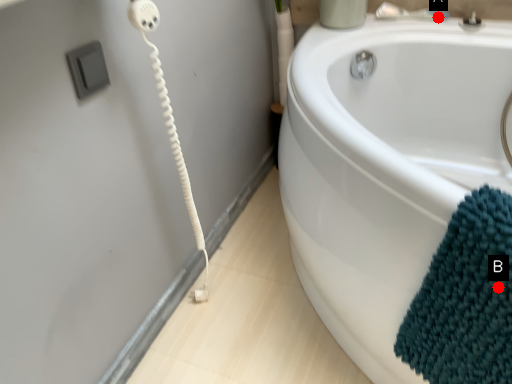
Question: Two points are circled on the image, labeled by A and B beside each circle. Among these points, which one is farthest from the camera?

Choices:
 (A) A is further
 (B) B is further

Answer: (A)